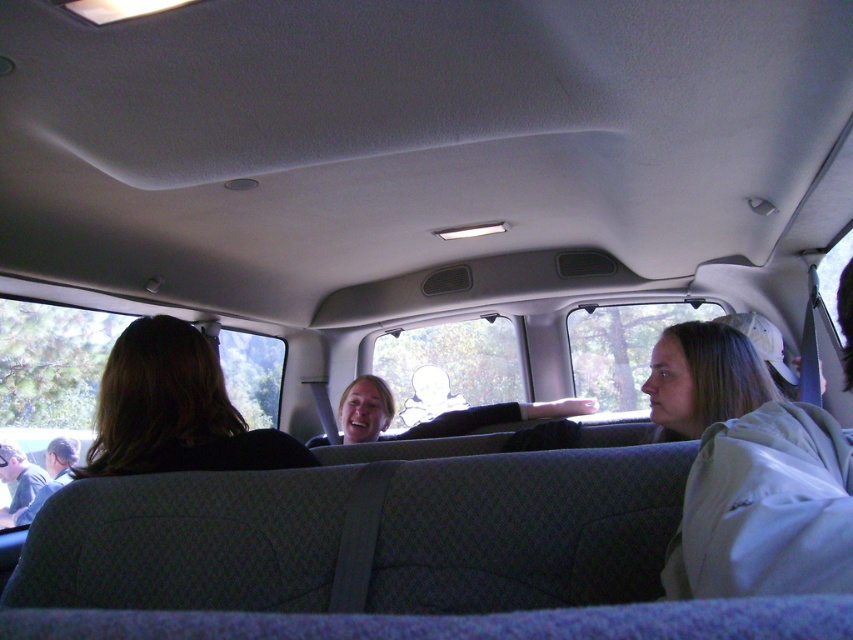
You are a passenger in the vehicle and want to know if the dark brown hair at left is longer than the dark gray shirt at lower left. Based on the scene, can you determine this?

The dark brown hair at left is shorter than the dark gray shirt at lower left, so it is not longer than the shirt.

You are a passenger sitting in the front row of the vehicle. You notice two shirts inside the vehicle. Which shirt, the matte black shirt at center or the dark gray shirt at lower left, is positioned more to the right?

The matte black shirt at center is positioned more to the right than the dark gray shirt at lower left.